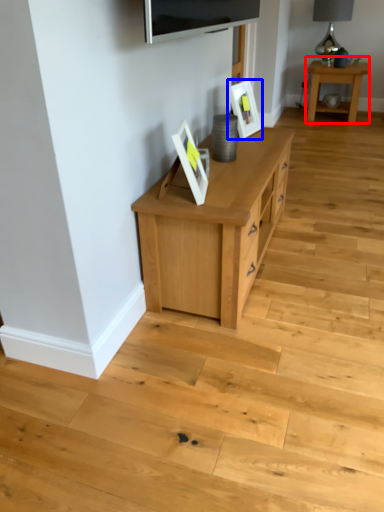
Question: Which object appears farthest to the camera in this image, table (highlighted by a red box) or picture frame (highlighted by a blue box)?

Choices:
 (A) table
 (B) picture frame

Answer: (A)